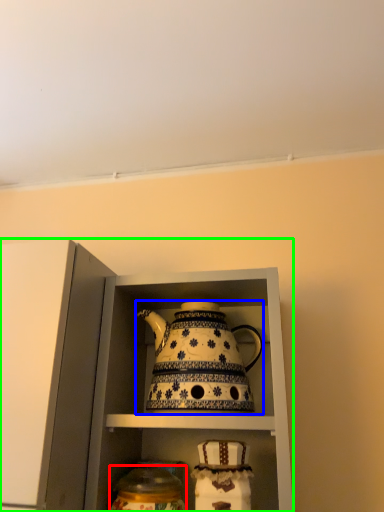
Question: Estimate the real-world distances between objects in this image. Which object is closer to tableware (highlighted by a red box), kettle (highlighted by a blue box) or cabinetry (highlighted by a green box)?

Choices:
 (A) kettle
 (B) cabinetry

Answer: (A)